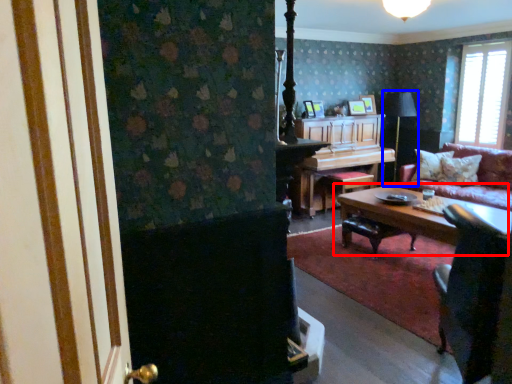
Question: Which object appears closest to the camera in this image, coffee table (highlighted by a red box) or table lamp (highlighted by a blue box)?

Choices:
 (A) coffee table
 (B) table lamp

Answer: (A)